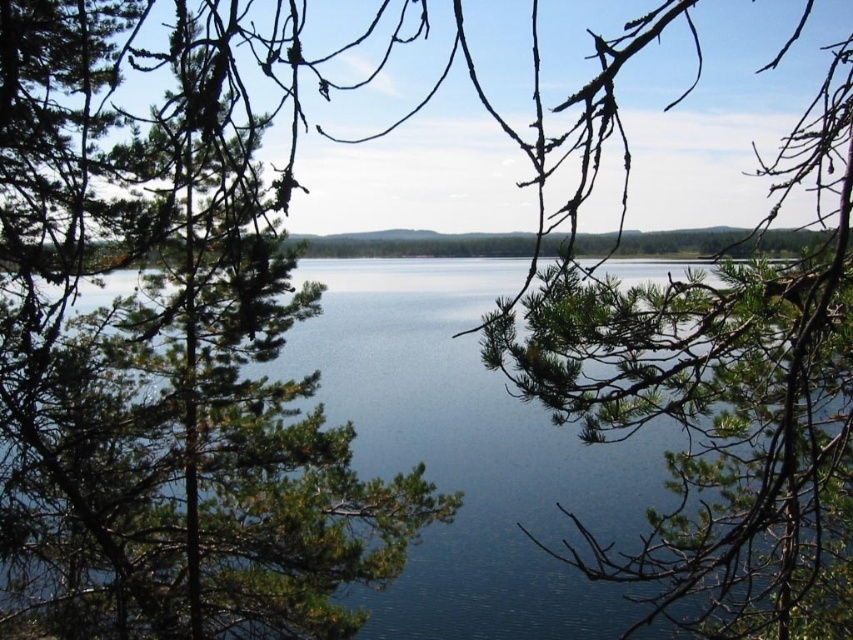
Can you confirm if green needle-like branches at center is smaller than blue water at center?

Yes.

The image size is (853, 640). What do you see at coordinates (161, 364) in the screenshot?
I see `green needle-like branches at center` at bounding box center [161, 364].

Between point (42, 234) and point (392, 371), which one is positioned behind?

The point (392, 371) is more distant.

You are a GUI agent. You are given a task and a screenshot of the screen. Output one action in this format:
    pyautogui.click(x=<x>, y=<y>)
    Task: Click on the green needle-like branches at center
    The image size is (853, 640).
    Given the screenshot: What is the action you would take?
    pyautogui.click(x=161, y=364)